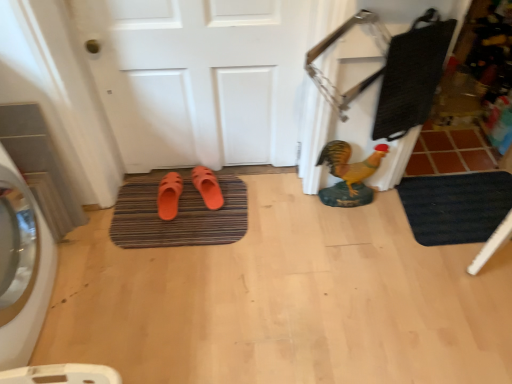
The width and height of the screenshot is (512, 384). Identify the location of free space in front of yellow matte chicken at center-right. (349, 234).